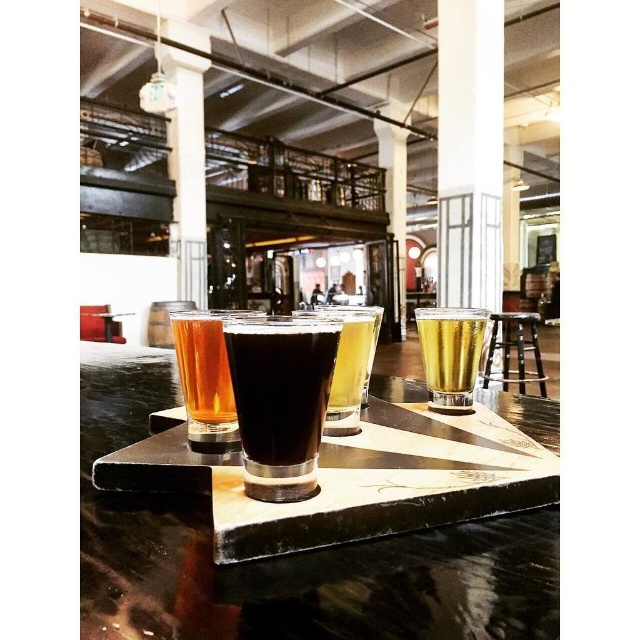
Question: Estimate the real-world distances between objects in this image. Which object is farther from the black leather stool at right?

Choices:
 (A) dark glass at center
 (B) black marble tray at center

Answer: (A)

Question: Which point is closer to the camera?

Choices:
 (A) (492, 314)
 (B) (465, 380)
 (C) (269, 360)

Answer: (C)

Question: In this image, where is translucent glass at center located relative to black leather stool at right?

Choices:
 (A) below
 (B) above

Answer: (B)

Question: Which is nearer to the black marble tray at center?

Choices:
 (A) black leather stool at right
 (B) translucent glass at center
 (C) dark glass at center

Answer: (C)

Question: Observing the image, what is the correct spatial positioning of dark glass at center in reference to black leather stool at right?

Choices:
 (A) above
 (B) below

Answer: (A)

Question: Can you confirm if black marble tray at center is positioned to the right of translucent glass at center?

Choices:
 (A) no
 (B) yes

Answer: (A)